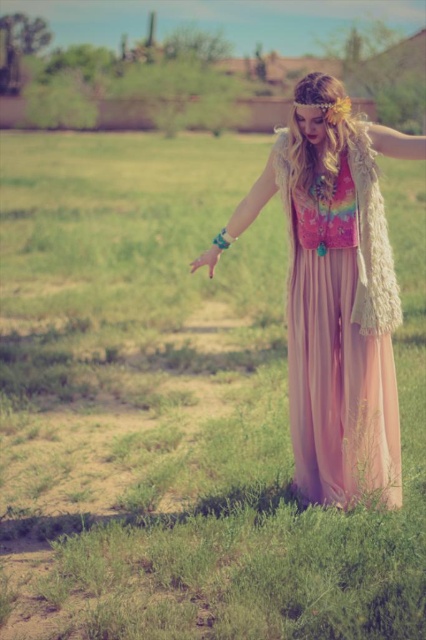
Between pastel chiffon dress at center and pink chiffon dress at center, which one has less height?

With less height is pink chiffon dress at center.

Looking at this image, which is more to the right, pastel chiffon dress at center or pink chiffon dress at center?

From the viewer's perspective, pink chiffon dress at center appears more on the right side.

Is point (367, 339) closer to viewer compared to point (394, 496)?

Yes, it is in front of point (394, 496).

Find the location of a particular element. pastel chiffon dress at center is located at coordinates (334, 292).